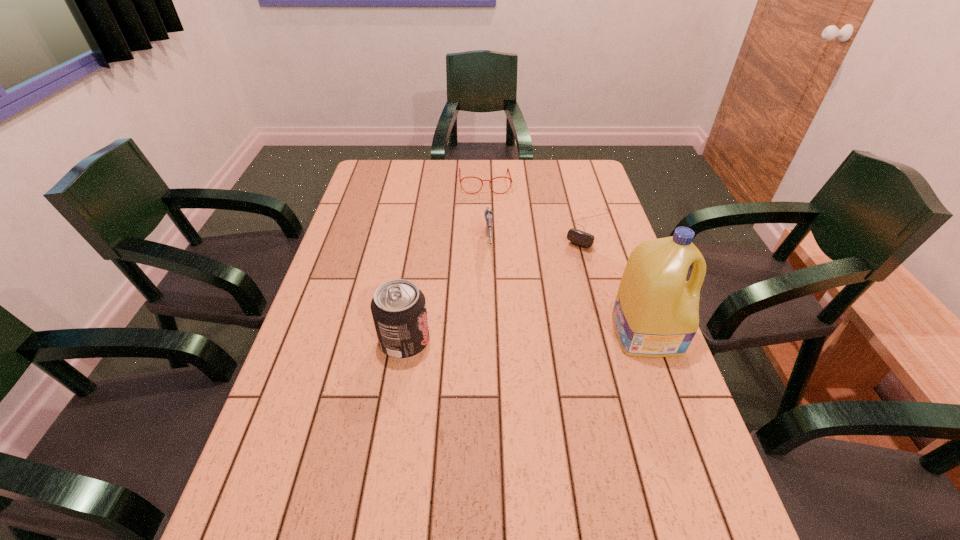
This screenshot has height=540, width=960. Identify the location of vacant space that is in between the webcam and the tallest object. (618, 281).

I want to click on vacant space in between the second shortest object and the tallest object, so click(565, 258).

The height and width of the screenshot is (540, 960). What are the coordinates of `unoccupied position between the shortest object and the second shortest object` in the screenshot? It's located at (538, 207).

Where is `free space that is in between the spectacles and the leftmost object`? The width and height of the screenshot is (960, 540). free space that is in between the spectacles and the leftmost object is located at coordinates (444, 262).

Locate an element on the screen. free point between the webcam and the spectacles is located at coordinates (538, 207).

Where is `object that ranks as the closest to the soda can`? object that ranks as the closest to the soda can is located at coordinates (488, 213).

Select which object appears as the third closest to the webcam. Please provide its 2D coordinates. Your answer should be formatted as a tuple, i.e. [(x, y)], where the tuple contains the x and y coordinates of a point satisfying the conditions above.

[(488, 213)]

This screenshot has height=540, width=960. Identify the location of vacant position in the image that satisfies the following two spatial constraints: 1. on the front side of the third shortest object; 2. on the label of the tallest object. (491, 332).

Find the location of a particular element. vacant position in the image that satisfies the following two spatial constraints: 1. on the back side of the farthest object; 2. on the left side of the leftmost object is located at coordinates (430, 183).

Where is `free location that satisfies the following two spatial constraints: 1. on the front side of the spectacles; 2. on the left side of the webcam`? This screenshot has width=960, height=540. free location that satisfies the following two spatial constraints: 1. on the front side of the spectacles; 2. on the left side of the webcam is located at coordinates (486, 230).